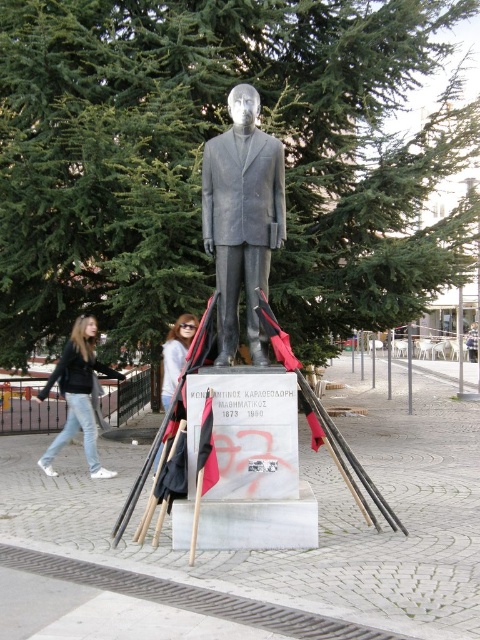
Who is lower down, bronze statue at center or jeans at lower left?

jeans at lower left

Does bronze statue at center have a smaller size compared to jeans at lower left?

Yes, bronze statue at center is smaller than jeans at lower left.

Which is in front, point (276, 196) or point (86, 356)?

Point (276, 196)

Image resolution: width=480 pixels, height=640 pixels. Find the location of `bronze statue at center`. bronze statue at center is located at coordinates (241, 218).